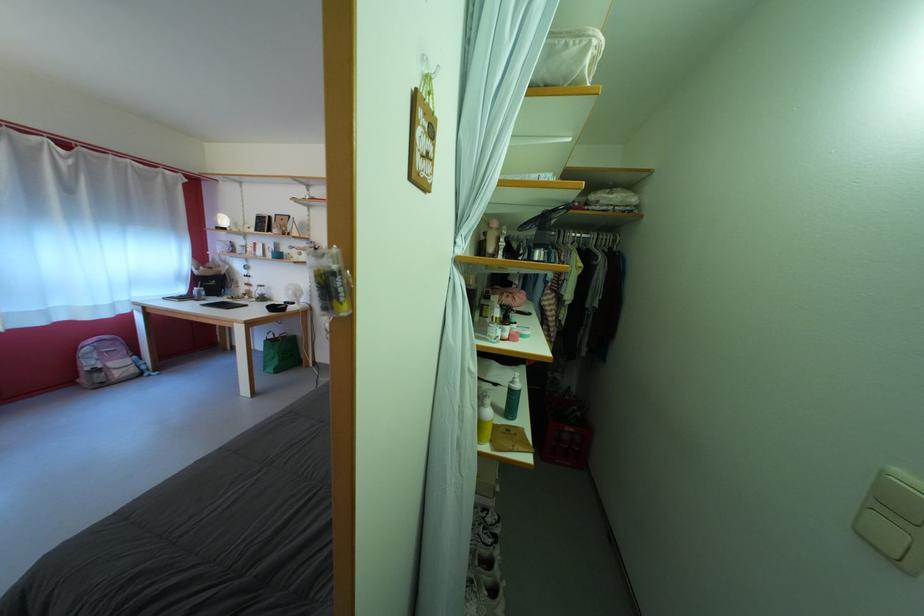
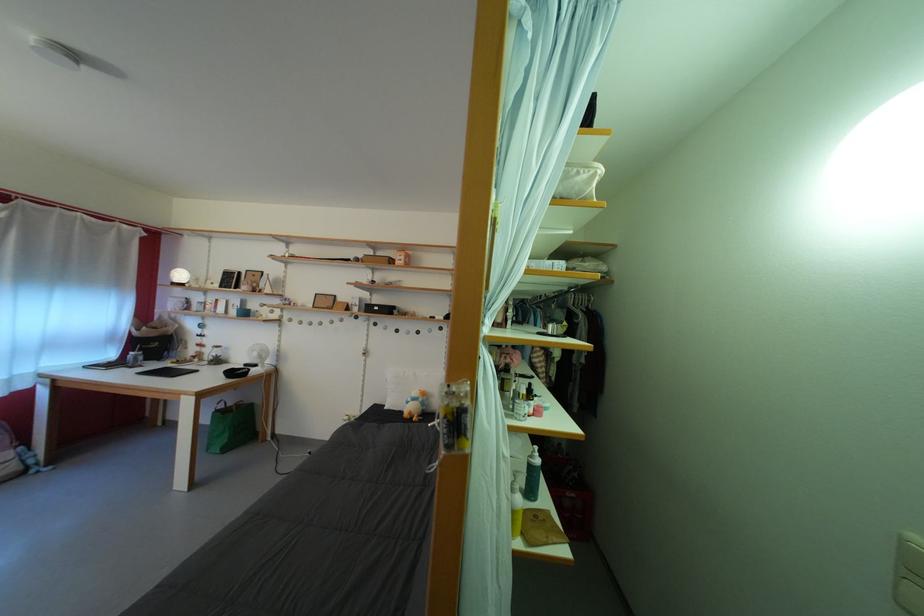
In the second image, find the point that corresponds to [275,346] in the first image.

(225, 416)